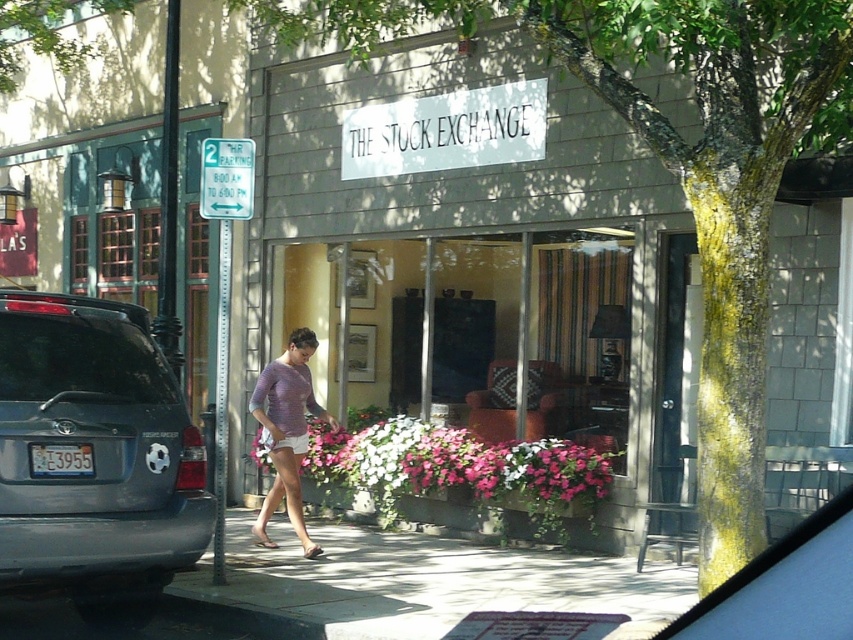
Question: Which point appears closest to the camera in this image?

Choices:
 (A) (624, 29)
 (B) (166, 502)
 (C) (625, 577)

Answer: (A)

Question: Estimate the real-world distances between objects in this image. Which object is closer to the smooth concrete sidewalk at center?

Choices:
 (A) knitted purple sweater at center
 (B) gray matte suv at left

Answer: (A)

Question: Among these points, which one is farthest from the camera?

Choices:
 (A) (402, 536)
 (B) (299, 531)
 (C) (634, 35)
 (D) (53, 374)

Answer: (A)

Question: Can you confirm if gray matte suv at left is positioned to the left of knitted purple sweater at center?

Choices:
 (A) no
 (B) yes

Answer: (B)

Question: Where is matte gray storefront at center located in relation to knitted purple sweater at center in the image?

Choices:
 (A) right
 (B) left

Answer: (A)

Question: Is smooth concrete sidewalk at center below knitted purple sweater at center?

Choices:
 (A) no
 (B) yes

Answer: (B)